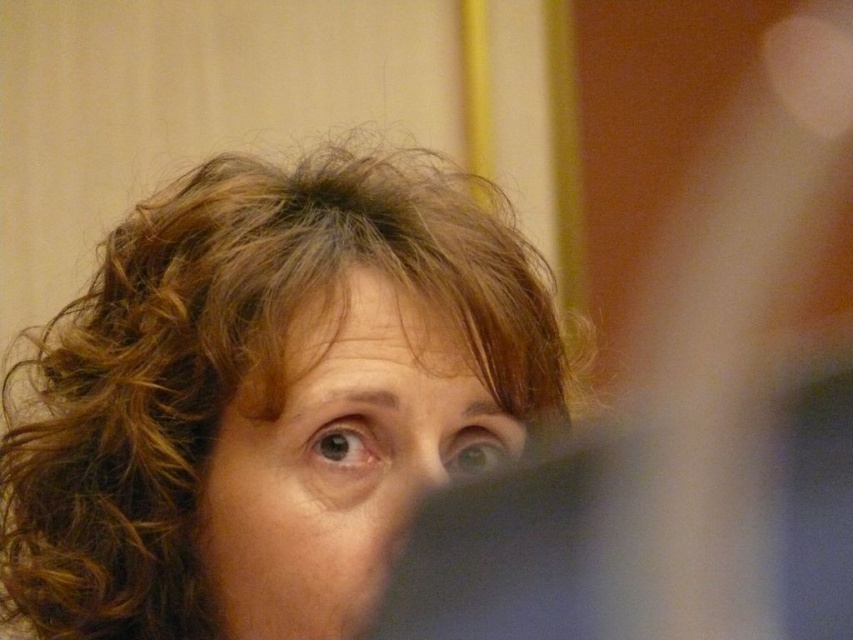
Does curly brown hair at upper center have a greater height compared to smooth skin face at center?

Indeed, curly brown hair at upper center has a greater height compared to smooth skin face at center.

Identify the location of curly brown hair at upper center. (267, 397).

What are the coordinates of `curly brown hair at upper center` in the screenshot? It's located at (267, 397).